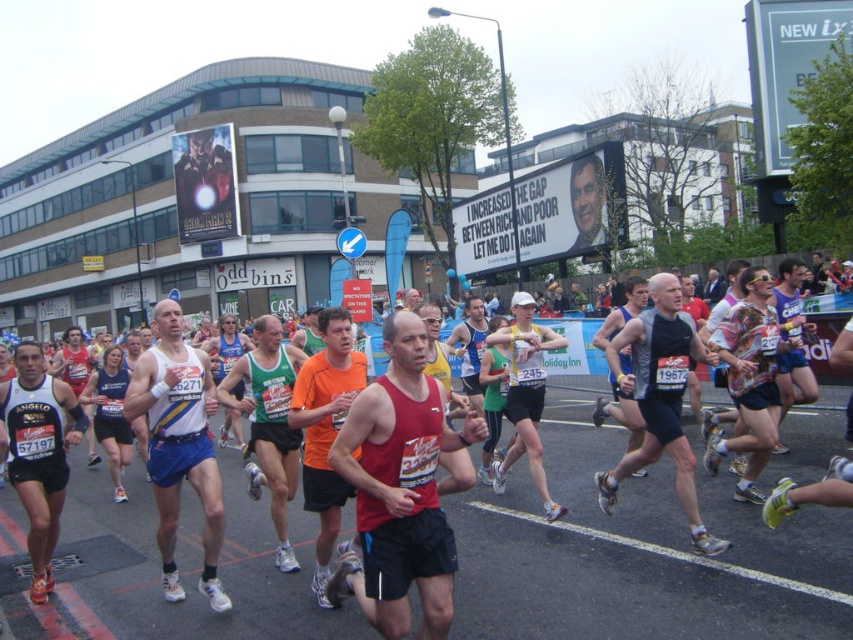
You are a photographer at the marathon event. You see a green jersey at center and a red tank top at center. Which runner is more to the right?

The green jersey at center is more to the right than the red tank top at center.

In the scene shown: You are a photographer positioned at the origin point of the image coordinate system. You want to capture a photo of the green jersey at center. What are the coordinates where you should aim your camera?

The green jersey at center is located at point (x=270, y=422), so you should aim your camera at those coordinates to capture it.

You are a photographer at the marathon and need to capture a photo that includes both the green jersey at center and the red tank top at center. Which clothing item should you focus on first to ensure both are in frame?

The green jersey at center has a greater height compared to the red tank top at center, so you should focus on the green jersey at center first to ensure both are in frame since it is taller and might require more space in the composition.